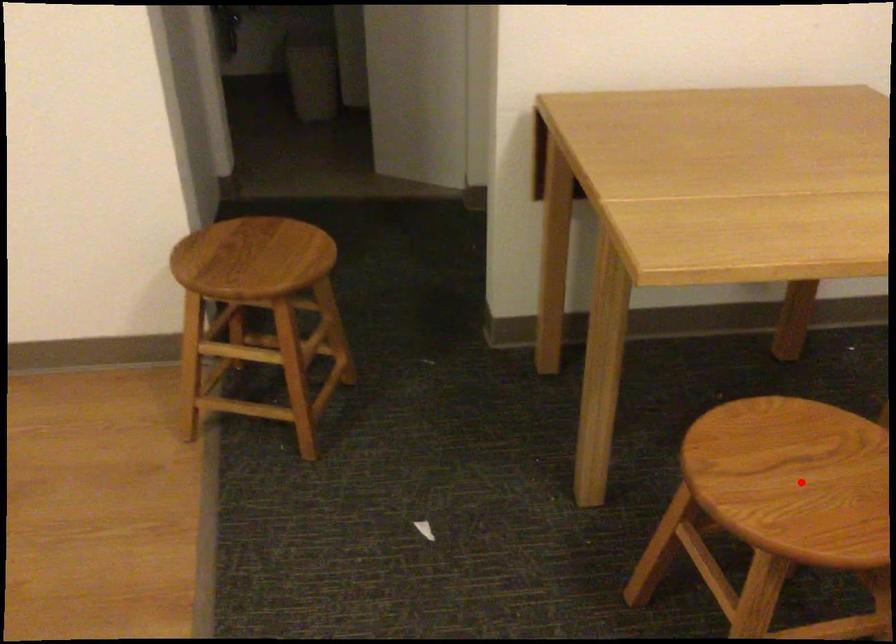
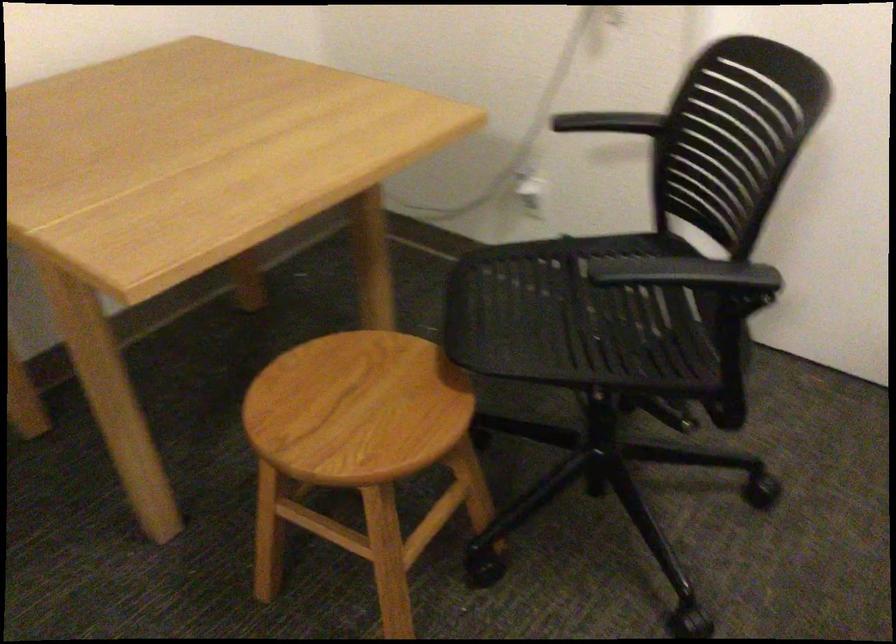
In the second image, find the point that corresponds to the highlighted location in the first image.

(356, 408)